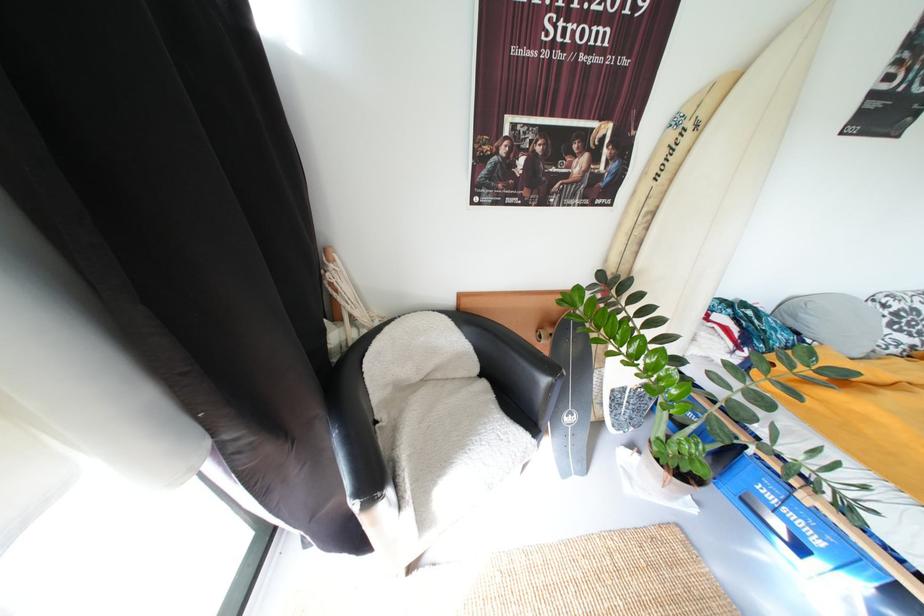
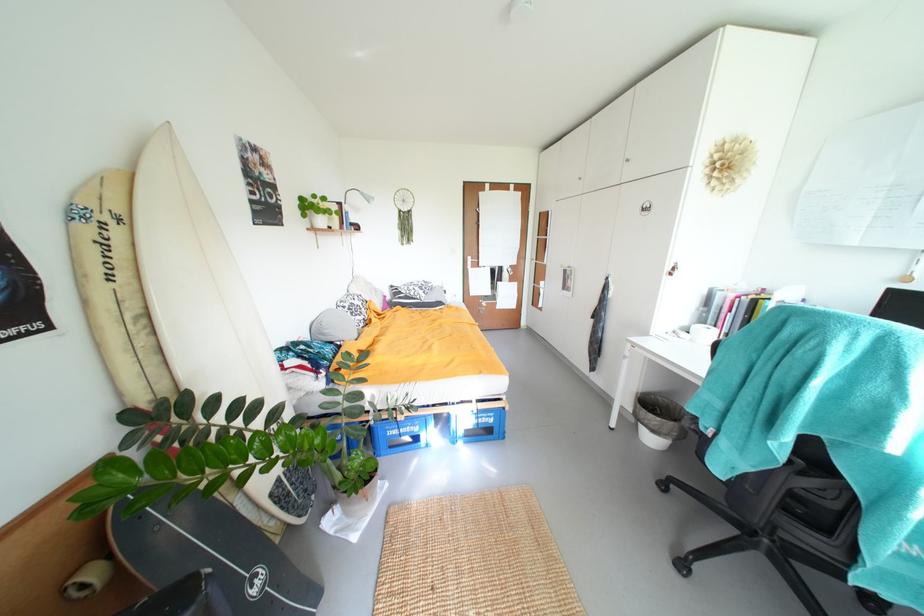
Based on the photo, the images are taken continuously from a first-person perspective. In which direction is your viewpoint rotating?

The rotation direction of the camera is right-down.